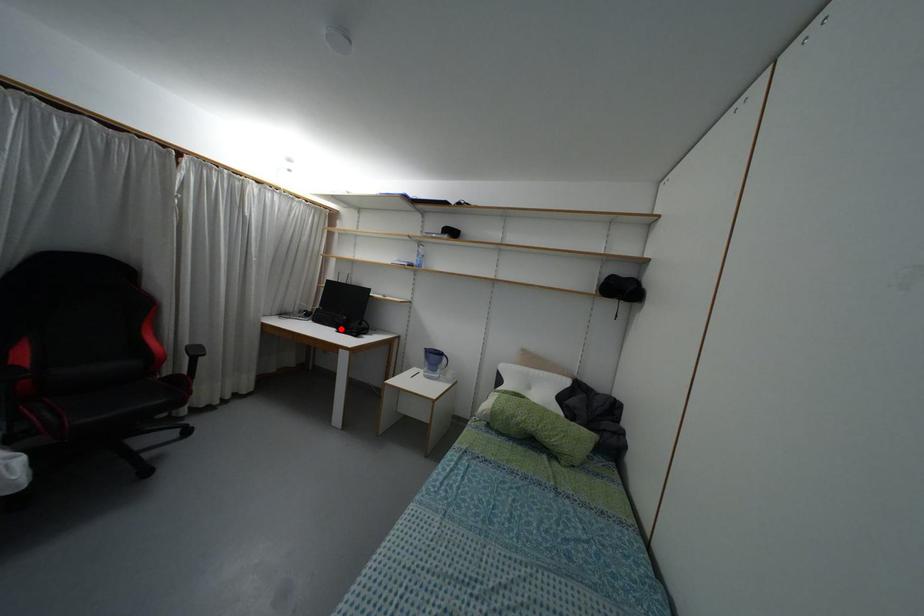
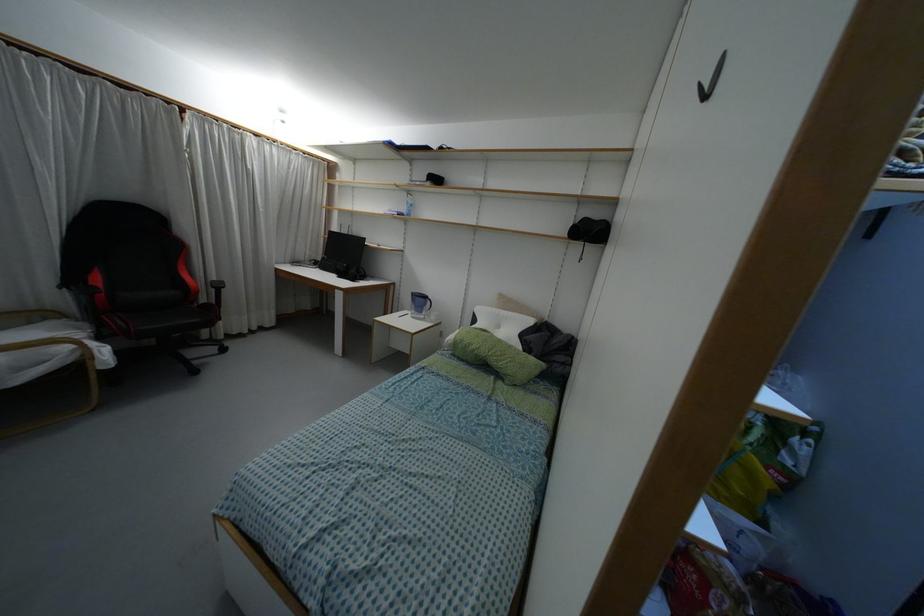
Where in the second image is the point corresponding to the highlighted location from the first image?

(341, 275)